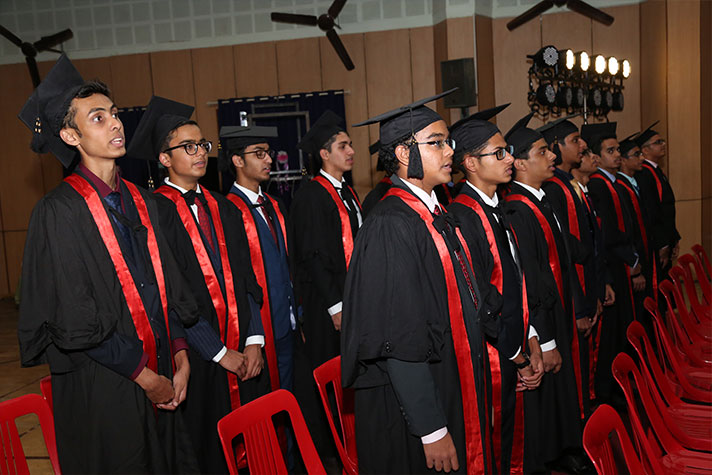
The width and height of the screenshot is (712, 475). In order to click on fan in this screenshot , I will do `click(48, 40)`, `click(325, 21)`, `click(525, 10)`.